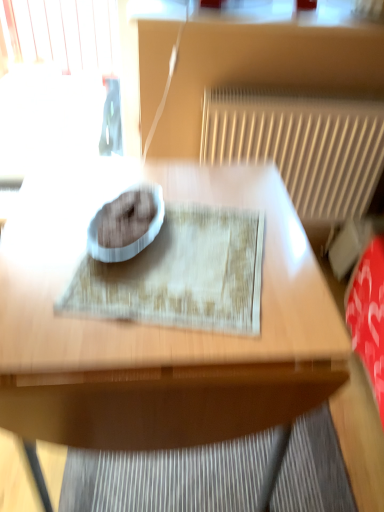
Locate an element on the screen. vacant space to the right of textured beige mat at center is located at coordinates (286, 275).